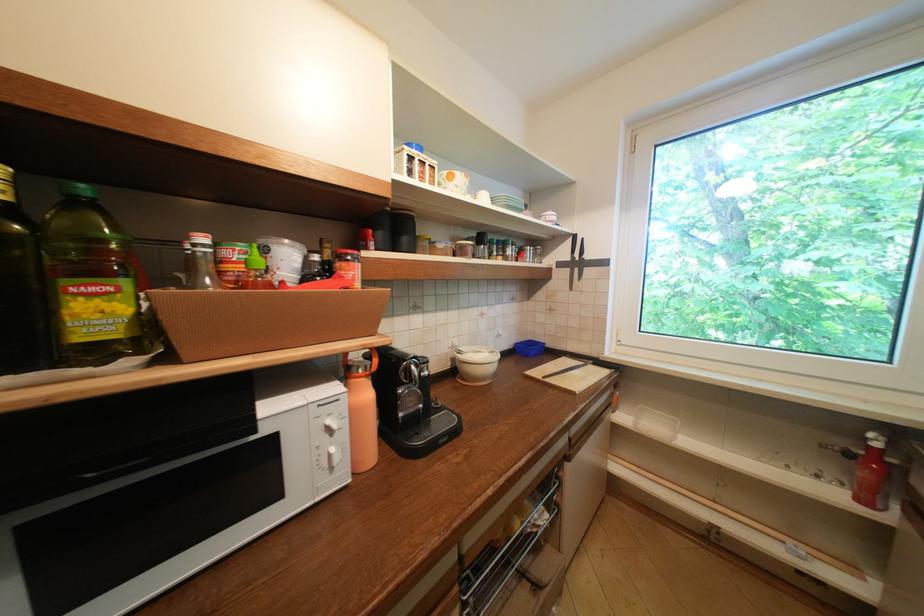
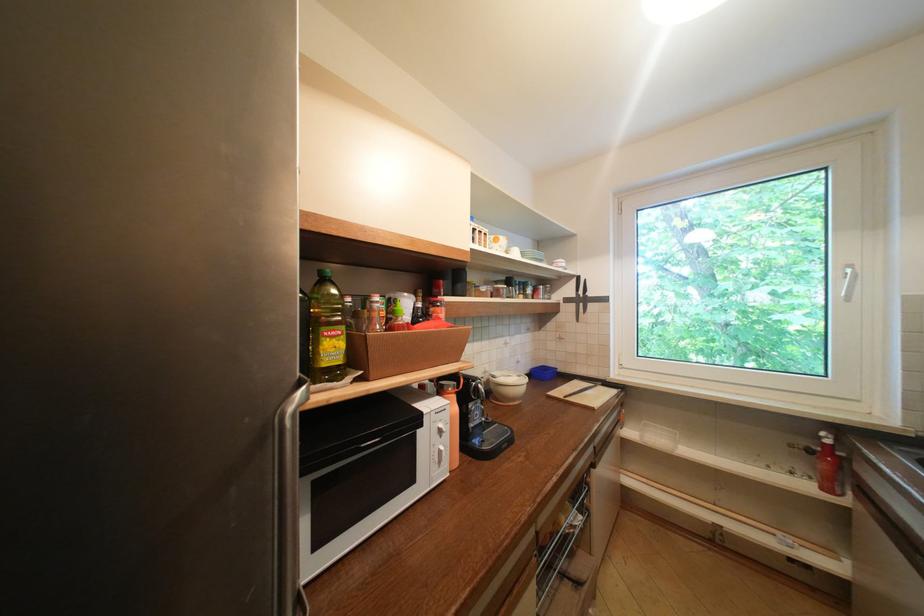
Find the pixel in the second image that matches the point at 410,419 in the first image.

(481, 429)